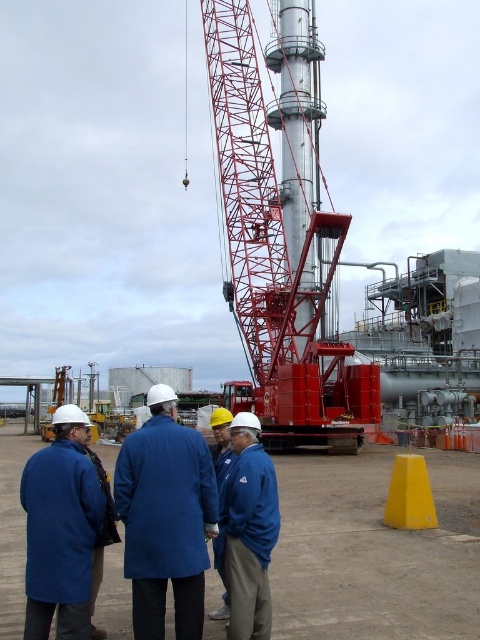
Question: Among these objects, which one is nearest to the camera?

Choices:
 (A) blue fabric jacket at center
 (B) blue matte jacket at lower left
 (C) yellow matte cone at lower right

Answer: (B)

Question: Which of these objects is positioned closest to the yellow matte cone at lower right?

Choices:
 (A) blue fabric jacket at center
 (B) blue matte jacket at lower left
 (C) red metallic crane at center
 (D) blue fabric coat at center

Answer: (A)

Question: Can you confirm if blue matte jacket at lower left is positioned to the right of yellow matte cone at lower right?

Choices:
 (A) no
 (B) yes

Answer: (A)

Question: Which of the following is the closest to the observer?

Choices:
 (A) (157, 467)
 (B) (417, 483)
 (C) (261, 547)
 (D) (91, 490)

Answer: (D)

Question: Is the position of blue fabric coat at center less distant than that of blue fabric jacket at center?

Choices:
 (A) yes
 (B) no

Answer: (A)

Question: Is blue fabric coat at center further to the viewer compared to yellow matte cone at lower right?

Choices:
 (A) yes
 (B) no

Answer: (B)